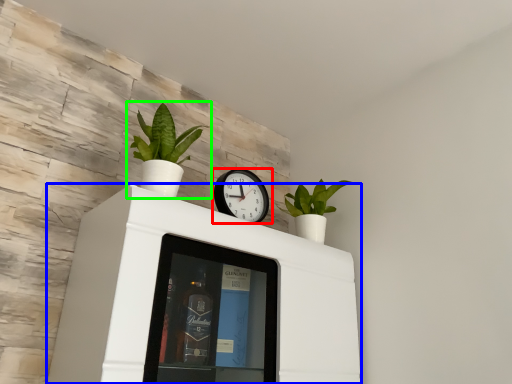
Question: Based on their relative distances, which object is nearer to wall clock (highlighted by a red box)? Choose from furniture (highlighted by a blue box) and houseplant (highlighted by a green box).

Choices:
 (A) furniture
 (B) houseplant

Answer: (B)